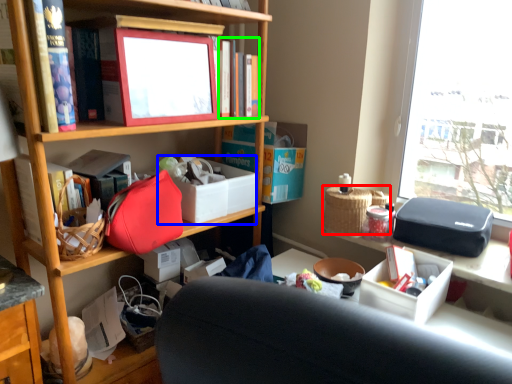
Question: Considering the real-world distances, which object is closest to picnic basket (highlighted by a red box)? storage box (highlighted by a blue box) or book (highlighted by a green box).

Choices:
 (A) storage box
 (B) book

Answer: (A)